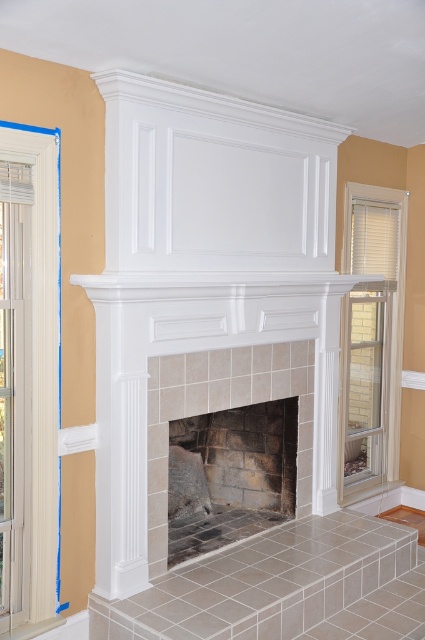
Consider the image. Is white wood window at right in front of clear glass door at left?

That is False.

Describe the element at coordinates (371, 339) in the screenshot. I see `white wood window at right` at that location.

Locate an element on the screen. white wood window at right is located at coordinates (371, 339).

What do you see at coordinates (229, 476) in the screenshot?
I see `dark gray stone fireplace at center` at bounding box center [229, 476].

Is point (265, 488) positioned behind point (47, 284)?

Yes, point (265, 488) is behind point (47, 284).

What do you see at coordinates (229, 476) in the screenshot? I see `dark gray stone fireplace at center` at bounding box center [229, 476].

Locate an element on the screen. dark gray stone fireplace at center is located at coordinates (229, 476).

Which of these two, white wood window at right or clear glass door at right, stands shorter?

clear glass door at right

What do you see at coordinates (371, 339) in the screenshot? I see `white wood window at right` at bounding box center [371, 339].

Identify the location of white wood window at right. The height and width of the screenshot is (640, 425). (371, 339).